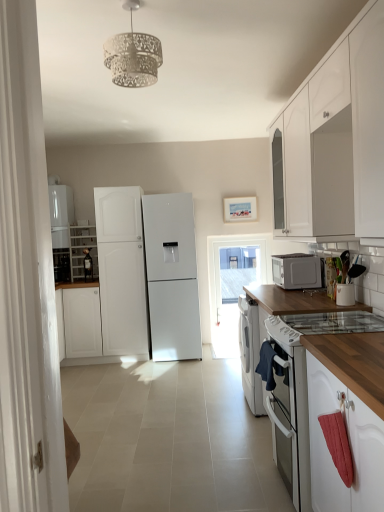
Question: Is white glass gas stove at lower right not within wooden at right?

Choices:
 (A) no
 (B) yes

Answer: (B)

Question: Can you confirm if white glass gas stove at lower right is smaller than wooden at right?

Choices:
 (A) no
 (B) yes

Answer: (B)

Question: Considering the relative sizes of white glass gas stove at lower right and wooden at right in the image provided, is white glass gas stove at lower right bigger than wooden at right?

Choices:
 (A) yes
 (B) no

Answer: (B)

Question: Is there a large distance between white glass gas stove at lower right and wooden at right?

Choices:
 (A) yes
 (B) no

Answer: (B)

Question: Does white glass gas stove at lower right have a lesser height compared to wooden at right?

Choices:
 (A) no
 (B) yes

Answer: (B)

Question: In the image, is transparent glass door at center on the left side or the right side of satin silver microwave at right?

Choices:
 (A) left
 (B) right

Answer: (A)

Question: Relative to satin silver microwave at right, is transparent glass door at center in front or behind?

Choices:
 (A) behind
 (B) front

Answer: (A)

Question: From a real-world perspective, is transparent glass door at center positioned above or below satin silver microwave at right?

Choices:
 (A) below
 (B) above

Answer: (A)

Question: Is transparent glass door at center inside the boundaries of satin silver microwave at right, or outside?

Choices:
 (A) inside
 (B) outside

Answer: (B)

Question: Is point (82, 256) positioned closer to the camera than point (286, 258)?

Choices:
 (A) closer
 (B) farther

Answer: (B)

Question: In the image, is white wood cabinet at left, the first cabinetry when ordered from back to front, on the left side or the right side of satin silver microwave at right?

Choices:
 (A) right
 (B) left

Answer: (B)

Question: From the image's perspective, is white wood cabinet at left, the first cabinetry when ordered from back to front, located above or below satin silver microwave at right?

Choices:
 (A) above
 (B) below

Answer: (A)

Question: Is white wood cabinet at left, acting as the 2th cabinetry starting from the front, in front of or behind satin silver microwave at right in the image?

Choices:
 (A) behind
 (B) front

Answer: (A)

Question: Looking at their shapes, would you say white wood cabinet at left, the 1th cabinetry positioned from the left, is wider or thinner than wooden at right?

Choices:
 (A) wide
 (B) thin

Answer: (B)

Question: From the image's perspective, is white wood cabinet at left, the first cabinetry when ordered from back to front, positioned above or below wooden at right?

Choices:
 (A) above
 (B) below

Answer: (A)